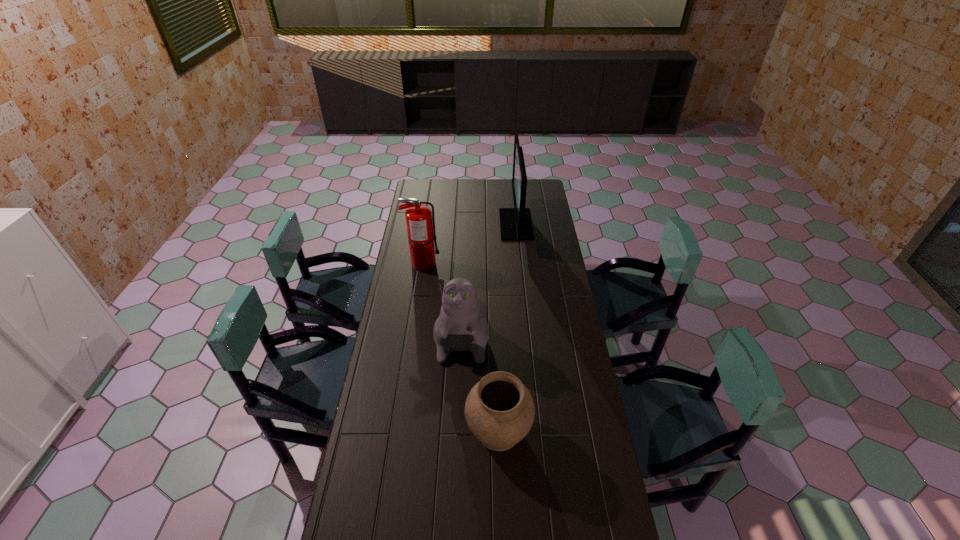
Identify the location of monitor. The height and width of the screenshot is (540, 960). (515, 223).

Image resolution: width=960 pixels, height=540 pixels. In order to click on the leftmost object in this screenshot , I will do `click(421, 232)`.

The width and height of the screenshot is (960, 540). I want to click on fire extinguisher, so click(421, 232).

This screenshot has width=960, height=540. Find the location of `cat`. cat is located at coordinates (460, 326).

Where is `the second shortest object`? This screenshot has height=540, width=960. the second shortest object is located at coordinates (460, 326).

The height and width of the screenshot is (540, 960). Find the location of `the shortest object`. the shortest object is located at coordinates (499, 410).

You are a GUI agent. You are given a task and a screenshot of the screen. Output one action in this format:
    pyautogui.click(x=<x>, y=<y>)
    Task: Click on the nearest object
    
    Given the screenshot: What is the action you would take?
    click(499, 410)

The height and width of the screenshot is (540, 960). In order to click on vacant region located 0.200m on the screen side of the monitor in this screenshot , I will do `click(465, 224)`.

In order to click on free space located 0.400m on the screen side of the monitor in this screenshot , I will do `click(429, 224)`.

Where is `free location located on the screen side of the monitor`? The width and height of the screenshot is (960, 540). free location located on the screen side of the monitor is located at coordinates (450, 224).